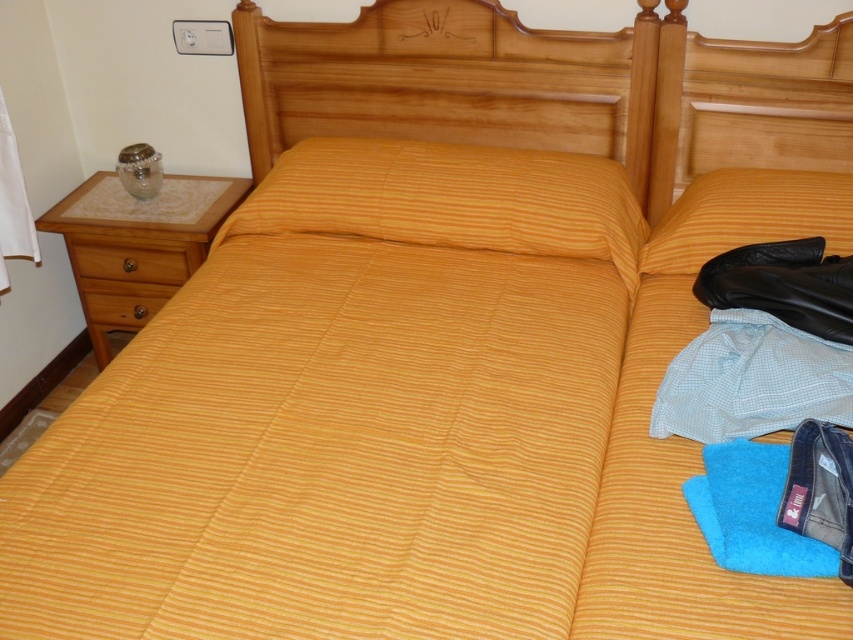
Is point (358, 17) closer to camera compared to point (547, 252)?

No, (358, 17) is behind (547, 252).

From the picture: Who is higher up, wooden headboard at upper center or yellow striped pillow at center?

Positioned higher is wooden headboard at upper center.

Is point (653, 19) positioned behind point (460, 186)?

Yes, point (653, 19) is farther from viewer.

Identify the location of wooden headboard at upper center. (450, 81).

Which is below, yellow striped pillow at center or blue microfiber towel at lower right?

blue microfiber towel at lower right

Is yellow striped pillow at center thinner than blue microfiber towel at lower right?

Incorrect, yellow striped pillow at center's width is not less than blue microfiber towel at lower right's.

The width and height of the screenshot is (853, 640). Find the location of `yellow striped pillow at center`. yellow striped pillow at center is located at coordinates (450, 198).

Between point (703, 214) and point (144, 317), which one is positioned in front?

Point (703, 214) is in front.

Looking at this image, is yellow striped pillow at upper right below wooden drawer at left?

No.

Identify the location of yellow striped pillow at upper right. This screenshot has height=640, width=853. (747, 216).

Where is `yellow striped pillow at upper right`? This screenshot has height=640, width=853. yellow striped pillow at upper right is located at coordinates (747, 216).